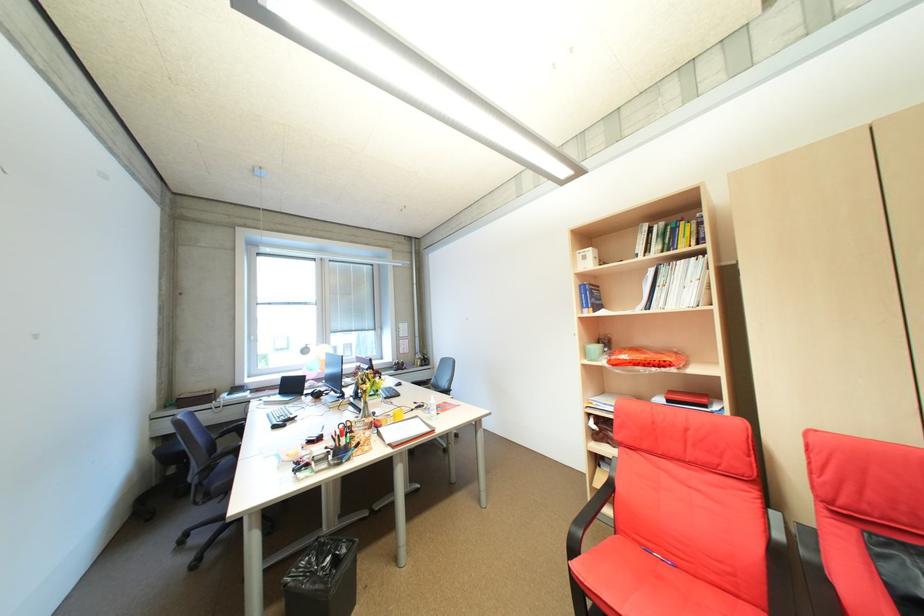
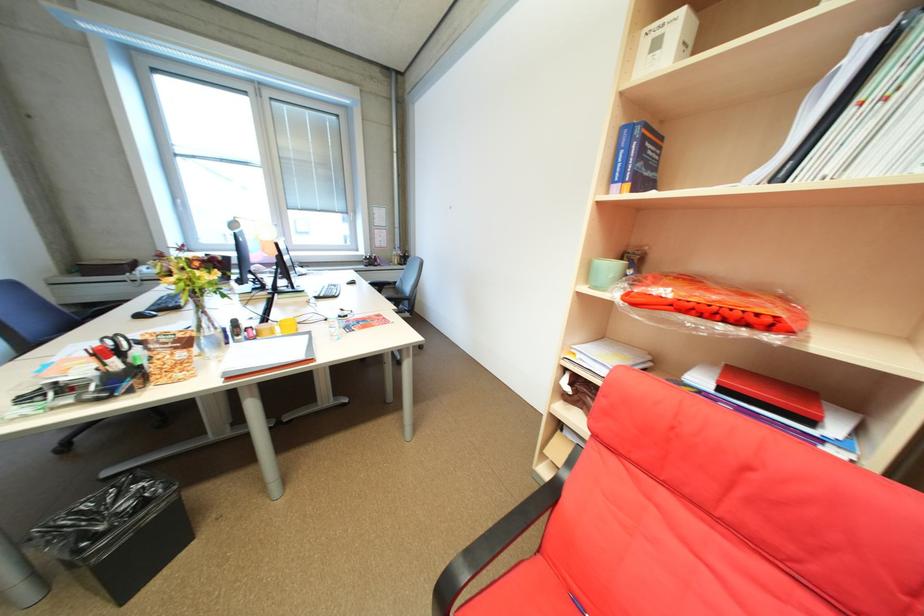
The images are taken continuously from a first-person perspective. In which direction are you moving?

The cameraman moved toward right, forward.